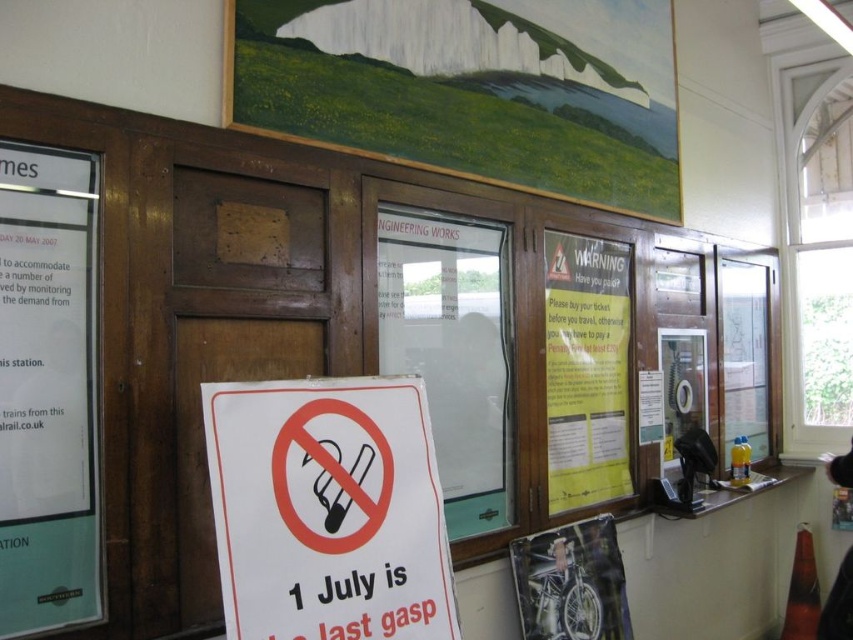
Question: Can you confirm if white paper sign at center is smaller than yellow paper poster at center?

Choices:
 (A) yes
 (B) no

Answer: (A)

Question: Can you confirm if white paper sign at center is positioned above green paper poster at left?

Choices:
 (A) no
 (B) yes

Answer: (A)

Question: Estimate the real-world distances between objects in this image. Which object is farther from the green paper poster at left?

Choices:
 (A) white paper sign at center
 (B) yellow paper poster at center

Answer: (B)

Question: Which object appears closest to the camera in this image?

Choices:
 (A) yellow paper poster at center
 (B) green paper poster at left
 (C) white paper sign at center

Answer: (C)

Question: Which object is the closest to the green paper poster at left?

Choices:
 (A) yellow paper poster at center
 (B) white paper sign at center

Answer: (B)

Question: Is white paper sign at center behind yellow paper poster at center?

Choices:
 (A) yes
 (B) no

Answer: (B)